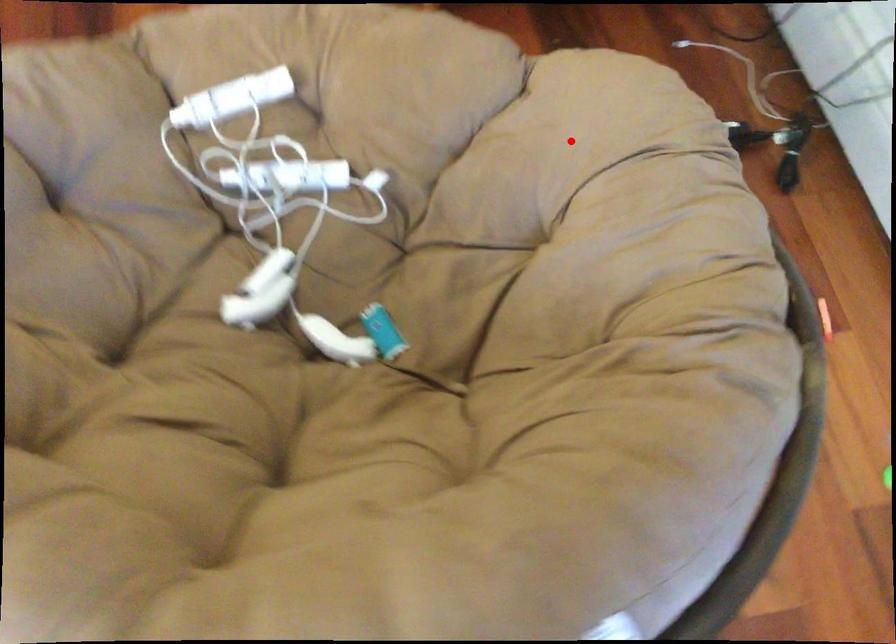
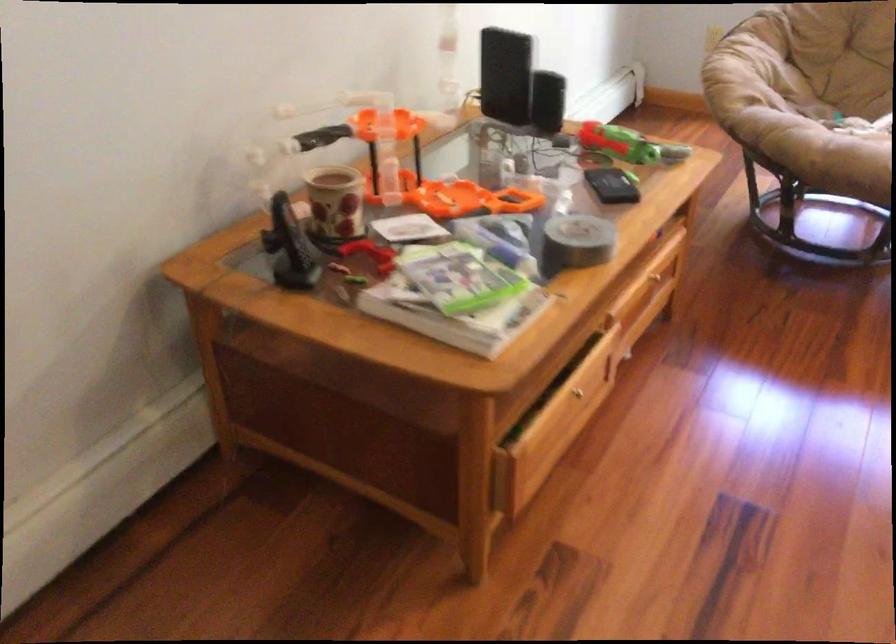
Find the pixel in the second image that matches the highlighted location in the first image.

(745, 69)